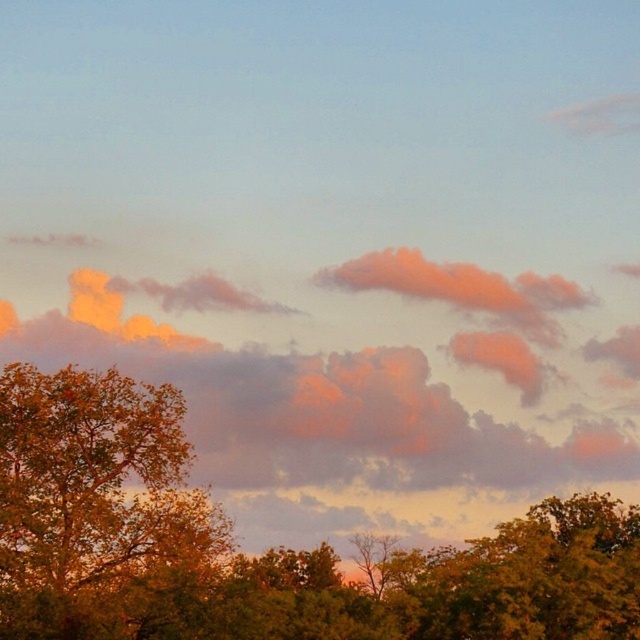
Question: Does green leafy tree at center come behind golden textured leaves at left?

Choices:
 (A) no
 (B) yes

Answer: (A)

Question: Which of the following is the farthest from the observer?

Choices:
 (A) golden textured leaves at left
 (B) green leafy tree at lower right
 (C) orange cotton clouds at center

Answer: (C)

Question: Which point is farther to the camera?

Choices:
 (A) orange cotton clouds at center
 (B) green leafy tree at center
 (C) golden textured leaves at left
 (D) green leafy tree at lower right

Answer: (A)

Question: Is orange cotton clouds at center below green leafy tree at lower right?

Choices:
 (A) no
 (B) yes

Answer: (A)

Question: Is green leafy tree at center above orange cotton clouds at center?

Choices:
 (A) no
 (B) yes

Answer: (A)

Question: Which of the following is the closest to the observer?

Choices:
 (A) (88, 392)
 (B) (96, 392)
 (C) (397, 257)
 (D) (536, 515)

Answer: (A)